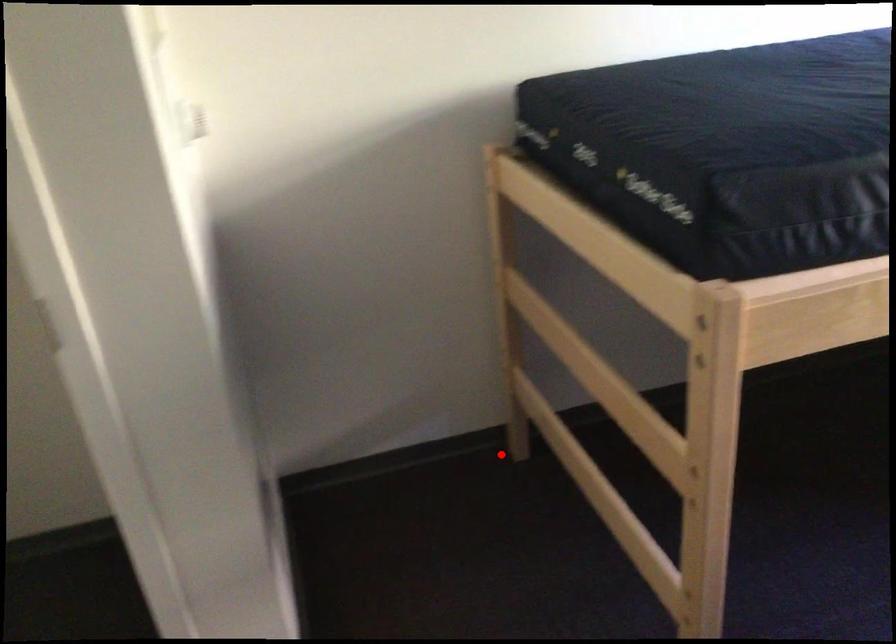
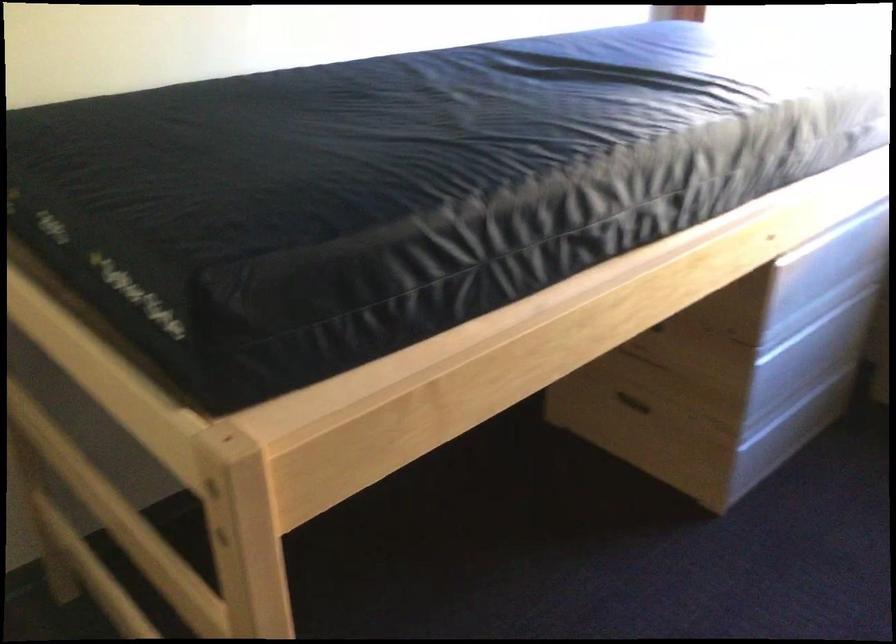
Find the pixel in the second image that matches the highlighted location in the first image.

(44, 608)